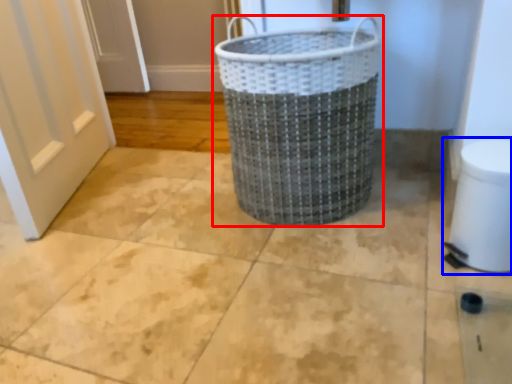
Question: Which of the following is the closest to the observer, waste container (highlighted by a red box) or toilet bowl (highlighted by a blue box)?

Choices:
 (A) waste container
 (B) toilet bowl

Answer: (B)